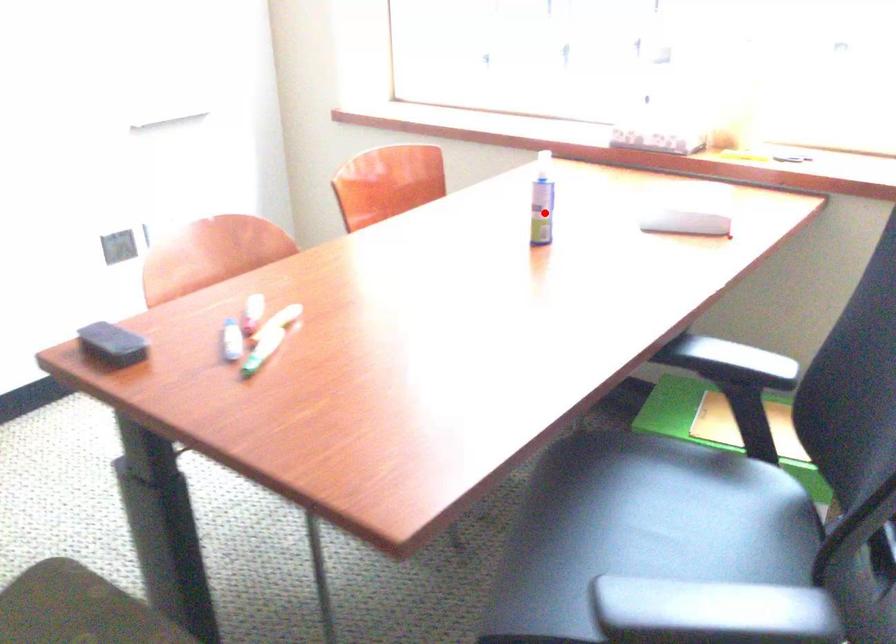
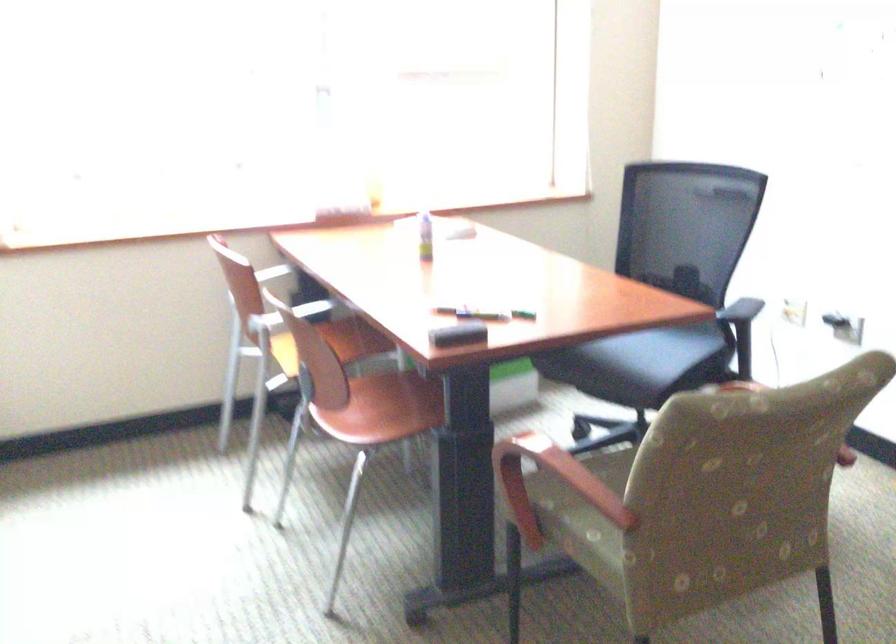
In the second image, find the point that corresponds to the highlighted location in the first image.

(425, 236)